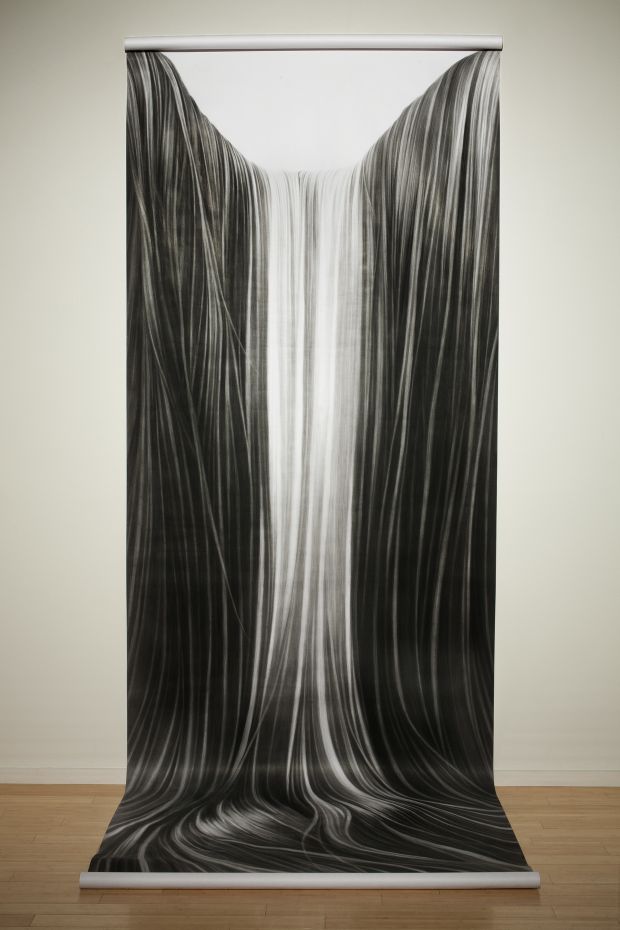
The height and width of the screenshot is (930, 620). I want to click on shadow on the floor, so click(x=441, y=910), click(x=162, y=913).